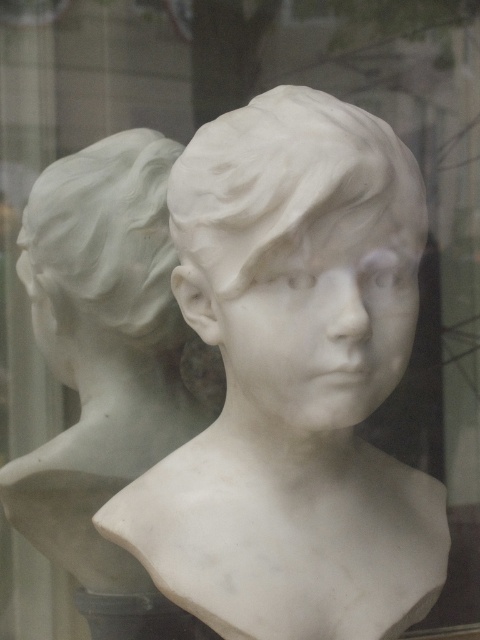
You are an art conservator assessing the space between two marble sculptures in a glass case. You need to determine if a 1.2 meter wide protective barrier can fit between the white marble bust at center and the white marble head at left. Can it fit?

The white marble bust at center is larger than the white marble head at left. Since the size difference may affect the space between them, but the exact distance isn answer the question cannot be definitively answered with the provided information.

You are an art conservator examining the image of two marble busts in a glass case. You need to locate the white marble bust at left precisely. According to the coordinates provided, what are its exact 2D coordinates in the image?

The white marble bust at left is located at the 2D coordinates of point (101, 348).